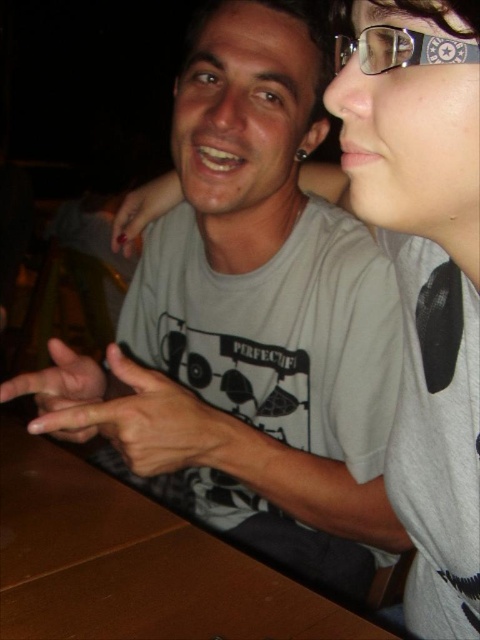
Question: Considering the relative positions of brown wooden table at center and nail polish at left in the image provided, where is brown wooden table at center located with respect to nail polish at left?

Choices:
 (A) above
 (B) below

Answer: (B)

Question: Can you confirm if brown wooden table at center is bigger than nail polish at left?

Choices:
 (A) no
 (B) yes

Answer: (B)

Question: Which object appears farthest from the camera in this image?

Choices:
 (A) clear plastic glasses at upper right
 (B) brown wooden table at center
 (C) matte gray hands at center

Answer: (C)

Question: Does clear plastic glasses at upper right lie in front of nail polish at left?

Choices:
 (A) yes
 (B) no

Answer: (A)

Question: Among these objects, which one is farthest from the camera?

Choices:
 (A) nail polish at left
 (B) matte skin hand at center
 (C) clear plastic glasses at upper right
 (D) matte gray hands at center

Answer: (A)

Question: Which point is closer to the camera?

Choices:
 (A) (43, 372)
 (B) (130, 209)
 (C) (340, 38)
 (D) (72, 440)

Answer: (C)